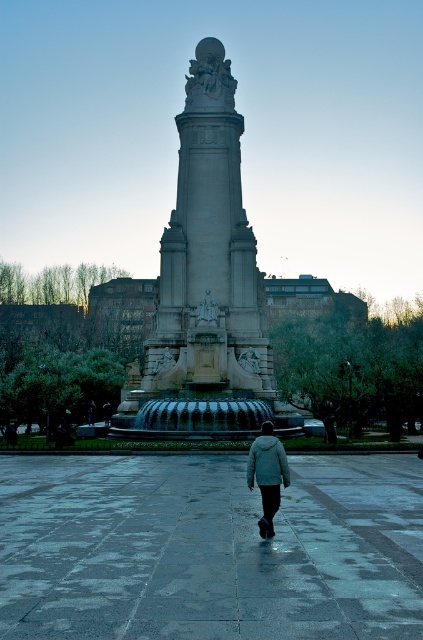
You are standing in the public square and want to reach the monument. You have two points marked on the ground in front of you, point A at coordinates point (283, 456) and point B at coordinates point (272, 461). Which point should you step on first if you want to move closer to the monument?

You should step on point A at coordinates point (283, 456) first because it is closer to you than point B at coordinates point (272, 461), which is further away.

You are standing at the camera position and want to take a photo of the gray stone monument at center. According to the coordinates given, where should you aim your camera to capture the monument perfectly in the frame?

The gray stone monument at center is located at coordinates point (206, 285), so you should aim your camera towards that point to capture it perfectly in the frame.

You are standing at the edge of the square and see the gray stone monument at center and the light gray woolen jacket at center. Which object is closer to your right side?

The light gray woolen jacket at center is closer to your right side because the gray stone monument at center is to its left.